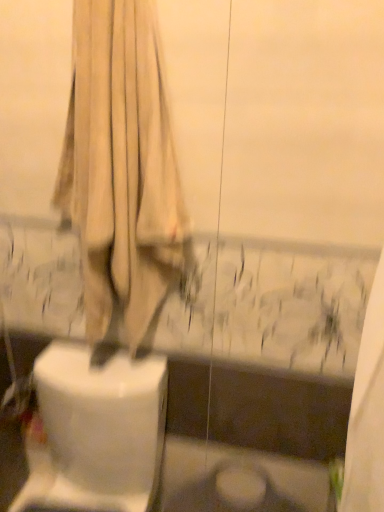
Where is `white glossy toilet at lower left`? The height and width of the screenshot is (512, 384). white glossy toilet at lower left is located at coordinates (96, 431).

The width and height of the screenshot is (384, 512). What do you see at coordinates (96, 431) in the screenshot?
I see `white glossy toilet at lower left` at bounding box center [96, 431].

What do you see at coordinates (122, 167) in the screenshot? Image resolution: width=384 pixels, height=512 pixels. I see `beige fabric curtain at upper center` at bounding box center [122, 167].

Where is `beige fabric curtain at upper center`? beige fabric curtain at upper center is located at coordinates coord(122,167).

What is the approximate height of beige fabric curtain at upper center?

beige fabric curtain at upper center is 31.71 inches in height.

Where is `white glossy toilet at lower left`? This screenshot has width=384, height=512. white glossy toilet at lower left is located at coordinates (96, 431).

Which object is positioned more to the left, white glossy toilet at lower left or beige fabric curtain at upper center?

white glossy toilet at lower left.

Which object is closer to the camera taking this photo, white glossy toilet at lower left or beige fabric curtain at upper center?

beige fabric curtain at upper center is closer to the camera.

Is point (133, 463) positioned after point (84, 128)?

That is True.

From the image's perspective, which object appears higher, white glossy toilet at lower left or beige fabric curtain at upper center?

beige fabric curtain at upper center, from the image's perspective.

From a real-world perspective, who is located higher, white glossy toilet at lower left or beige fabric curtain at upper center?

beige fabric curtain at upper center.

Considering the relative sizes of white glossy toilet at lower left and beige fabric curtain at upper center in the image provided, is white glossy toilet at lower left wider than beige fabric curtain at upper center?

Yes.

In the scene shown: In terms of height, does white glossy toilet at lower left look taller or shorter compared to beige fabric curtain at upper center?

In the image, white glossy toilet at lower left appears to be shorter than beige fabric curtain at upper center.

Between white glossy toilet at lower left and beige fabric curtain at upper center, which one has larger size?

white glossy toilet at lower left.

Is white glossy toilet at lower left not inside beige fabric curtain at upper center?

That's correct, white glossy toilet at lower left is outside of beige fabric curtain at upper center.

Is white glossy toilet at lower left next to beige fabric curtain at upper center and touching it?

No, white glossy toilet at lower left is not with beige fabric curtain at upper center.

Is white glossy toilet at lower left turned away from beige fabric curtain at upper center?

No, white glossy toilet at lower left's orientation is not away from beige fabric curtain at upper center.

How different are the orientations of white glossy toilet at lower left and beige fabric curtain at upper center in degrees?

The angle between the facing direction of white glossy toilet at lower left and the facing direction of beige fabric curtain at upper center is 2.09 degrees.

At what (x,y) coordinates should I click in order to perform the action: click on toilet below the beige fabric curtain at upper center (from the image's perspective). Please return your answer as a coordinate pair (x, y). Image resolution: width=384 pixels, height=512 pixels. Looking at the image, I should click on (96, 431).

Does beige fabric curtain at upper center appear on the left side of white glossy toilet at lower left?

Incorrect, beige fabric curtain at upper center is not on the left side of white glossy toilet at lower left.

In the image, is beige fabric curtain at upper center positioned in front of or behind white glossy toilet at lower left?

Visually, beige fabric curtain at upper center is located in front of white glossy toilet at lower left.

Is point (136, 199) closer to viewer compared to point (87, 470)?

Yes, it is.

From the image's perspective, who appears lower, beige fabric curtain at upper center or white glossy toilet at lower left?

white glossy toilet at lower left appears lower in the image.

From a real-world perspective, is beige fabric curtain at upper center above or below white glossy toilet at lower left?

beige fabric curtain at upper center is above white glossy toilet at lower left.

Looking at their sizes, would you say beige fabric curtain at upper center is wider or thinner than white glossy toilet at lower left?

In the image, beige fabric curtain at upper center appears to be more narrow than white glossy toilet at lower left.

Is beige fabric curtain at upper center shorter than white glossy toilet at lower left?

No.

Looking at the image, does beige fabric curtain at upper center seem bigger or smaller compared to white glossy toilet at lower left?

Considering their sizes, beige fabric curtain at upper center takes up less space than white glossy toilet at lower left.

Is beige fabric curtain at upper center situated inside white glossy toilet at lower left or outside?

beige fabric curtain at upper center is not inside white glossy toilet at lower left, it's outside.

Is beige fabric curtain at upper center next to white glossy toilet at lower left?

beige fabric curtain at upper center and white glossy toilet at lower left are clearly separated.

Is white glossy toilet at lower left at the back of beige fabric curtain at upper center?

No, beige fabric curtain at upper center is not facing the opposite direction of white glossy toilet at lower left.

What's the angular difference between beige fabric curtain at upper center and white glossy toilet at lower left's facing directions?

2.09 degrees.

How far apart are beige fabric curtain at upper center and white glossy toilet at lower left?

A distance of 15.43 inches exists between beige fabric curtain at upper center and white glossy toilet at lower left.

I want to click on curtain above the white glossy toilet at lower left (from the image's perspective), so click(122, 167).

Identify the location of curtain on the right of the white glossy toilet at lower left. (122, 167).

Image resolution: width=384 pixels, height=512 pixels. In the image, there is a beige fabric curtain at upper center. What are the coordinates of `toilet below it (from a real-world perspective)` in the screenshot? It's located at (96, 431).